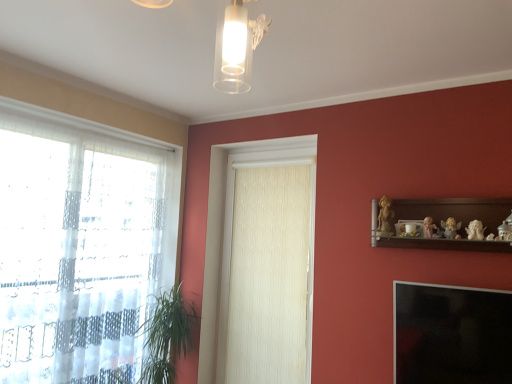
Where is `matte white figurine at upper right, arranged as the 2th toy when viewed from the left`? The image size is (512, 384). matte white figurine at upper right, arranged as the 2th toy when viewed from the left is located at coordinates (426, 228).

You are a GUI agent. You are given a task and a screenshot of the screen. Output one action in this format:
    pyautogui.click(x=<x>, y=<y>)
    Task: Click on the transparent fabric at left
    This screenshot has width=512, height=384.
    Given the screenshot: What is the action you would take?
    pyautogui.click(x=78, y=247)

Describe the element at coordinates (78, 247) in the screenshot. I see `transparent fabric at left` at that location.

Image resolution: width=512 pixels, height=384 pixels. What are the coordinates of `white porcelain figurine at upper right, which ranks as the second toy in right-to-left order` in the screenshot? It's located at (475, 230).

What is the approximate height of porcelain figurine at upper right, arranged as the fifth toy when viewed from the left?

The height of porcelain figurine at upper right, arranged as the fifth toy when viewed from the left, is 6.94 inches.

The height and width of the screenshot is (384, 512). Find the location of `matte gold angel at upper right, which appears as the 3th toy when viewed from the left`. matte gold angel at upper right, which appears as the 3th toy when viewed from the left is located at coordinates [x=450, y=228].

Considering the relative positions of white textured curtain at center and wooden shelf at upper right in the image provided, is white textured curtain at center to the right of wooden shelf at upper right from the viewer's perspective?

Incorrect, white textured curtain at center is not on the right side of wooden shelf at upper right.

Is white textured curtain at center touching wooden shelf at upper right?

No.

Which is behind, white textured curtain at center or wooden shelf at upper right?

white textured curtain at center is behind.

Measure the distance between white textured curtain at center and wooden shelf at upper right.

1.09 meters.

Is white porcelain figurine at upper right, positioned as the fourth toy in left-to-right order, positioned with its back to porcelain figurine at upper right, which is the first toy in right-to-left order?

No, white porcelain figurine at upper right, positioned as the fourth toy in left-to-right order, is not facing away from porcelain figurine at upper right, which is the first toy in right-to-left order.

At what (x,y) coordinates should I click in order to perform the action: click on the 3rd toy below the porcelain figurine at upper right, which is the first toy in right-to-left order (from the image's perspective). Please return your answer as a coordinate pair (x, y). Looking at the image, I should click on pos(475,230).

Based on the photo, which object is further away from the camera, white porcelain figurine at upper right, positioned as the fourth toy in left-to-right order, or porcelain figurine at upper right, which is the first toy in right-to-left order?

white porcelain figurine at upper right, positioned as the fourth toy in left-to-right order, is further away from the camera.

From the picture: From the image's perspective, is white porcelain figurine at upper right, positioned as the fourth toy in left-to-right order, above or below porcelain figurine at upper right, arranged as the fifth toy when viewed from the left?

white porcelain figurine at upper right, positioned as the fourth toy in left-to-right order, is situated lower than porcelain figurine at upper right, arranged as the fifth toy when viewed from the left, in the image.

Which object is closer to the camera taking this photo, white textured curtain at center or porcelain figurine at upper right, which is the first toy in right-to-left order?

Positioned in front is porcelain figurine at upper right, which is the first toy in right-to-left order.

Does white textured curtain at center have a smaller size compared to porcelain figurine at upper right, arranged as the fifth toy when viewed from the left?

No, white textured curtain at center is not smaller than porcelain figurine at upper right, arranged as the fifth toy when viewed from the left.

Is white textured curtain at center to the left of porcelain figurine at upper right, arranged as the fifth toy when viewed from the left, from the viewer's perspective?

Yes.

Is white textured curtain at center in contact with porcelain figurine at upper right, which is the first toy in right-to-left order?

white textured curtain at center and porcelain figurine at upper right, which is the first toy in right-to-left order, are not in contact.

Is transparent fabric at left shorter than porcelain figurine at upper right, arranged as the fifth toy when viewed from the left?

No.

Can you confirm if transparent fabric at left is bigger than porcelain figurine at upper right, which is the first toy in right-to-left order?

Yes.

Choose the correct answer: Is transparent fabric at left inside porcelain figurine at upper right, which is the first toy in right-to-left order, or outside it?

transparent fabric at left cannot be found inside porcelain figurine at upper right, which is the first toy in right-to-left order.

Could you tell me if transparent fabric at left is facing porcelain figurine at upper right, which is the first toy in right-to-left order?

Yes, transparent fabric at left is turned towards porcelain figurine at upper right, which is the first toy in right-to-left order.

Who is more distant, transparent fabric at left or wooden shelf at upper right?

transparent fabric at left.

In the scene shown: How much distance is there between transparent fabric at left and wooden shelf at upper right?

transparent fabric at left and wooden shelf at upper right are 6.91 feet apart.

In terms of height, does transparent fabric at left look taller or shorter compared to wooden shelf at upper right?

transparent fabric at left is taller than wooden shelf at upper right.

At what (x,y) coordinates should I click in order to perform the action: click on shelf that appears in front of the transparent fabric at left. Please return your answer as a coordinate pair (x, y). Looking at the image, I should click on (446, 218).

Is matte white figurine at upper right, arranged as the 2th toy when viewed from the left, not near transparent glass window screen at lower right?

They are positioned close to each other.

Does point (426, 233) come closer to viewer compared to point (476, 299)?

That is False.

Considering the relative positions of matte white figurine at upper right, marked as the 4th toy in a right-to-left arrangement, and transparent glass window screen at lower right in the image provided, is matte white figurine at upper right, marked as the 4th toy in a right-to-left arrangement, to the left or to the right of transparent glass window screen at lower right?

matte white figurine at upper right, marked as the 4th toy in a right-to-left arrangement, is to the left of transparent glass window screen at lower right.

Are white textured curtain at center and white porcelain figurine at upper right, which ranks as the second toy in right-to-left order, beside each other?

white textured curtain at center is not next to white porcelain figurine at upper right, which ranks as the second toy in right-to-left order, and they're not touching.

Relative to white porcelain figurine at upper right, which ranks as the second toy in right-to-left order, is white textured curtain at center in front or behind?

Clearly, white textured curtain at center is behind white porcelain figurine at upper right, which ranks as the second toy in right-to-left order.

Measure the distance from white textured curtain at center to white porcelain figurine at upper right, positioned as the fourth toy in left-to-right order.

The distance of white textured curtain at center from white porcelain figurine at upper right, positioned as the fourth toy in left-to-right order, is 1.56 meters.

From a real-world perspective, is white textured curtain at center physically below white porcelain figurine at upper right, which ranks as the second toy in right-to-left order?

Yes, from a real-world perspective, white textured curtain at center is below white porcelain figurine at upper right, which ranks as the second toy in right-to-left order.

In order to click on shelf above the white textured curtain at center (from a real-world perspective) in this screenshot , I will do coord(446,218).

From the image's perspective, starting from the white porcelain figurine at upper right, which ranks as the second toy in right-to-left order, which toy is the 3rd one above? Please provide its 2D coordinates.

[(505, 230)]

In the scene shown: When comparing their distances from green leafy plant at lower left, does porcelain figurine at upper right, which is the first toy in right-to-left order, or white textured curtain at center seem closer?

white textured curtain at center is closer to green leafy plant at lower left.

Estimate the real-world distances between objects in this image. Which object is closer to green leafy plant at lower left, matte white figurine at upper right, marked as the 4th toy in a right-to-left arrangement, or wooden statue at upper right, the 5th toy when ordered from right to left?

wooden statue at upper right, the 5th toy when ordered from right to left, lies closer to green leafy plant at lower left than the other object.

Considering their positions, is matte white figurine at upper right, marked as the 4th toy in a right-to-left arrangement, positioned further to wooden shelf at upper right than porcelain figurine at upper right, which is the first toy in right-to-left order?

The object further to wooden shelf at upper right is porcelain figurine at upper right, which is the first toy in right-to-left order.

Consider the image. Considering their positions, is porcelain figurine at upper right, arranged as the fifth toy when viewed from the left, positioned closer to white textured curtain at center than white porcelain figurine at upper right, positioned as the fourth toy in left-to-right order?

white porcelain figurine at upper right, positioned as the fourth toy in left-to-right order, is positioned closer to the anchor white textured curtain at center.

Considering their positions, is matte white figurine at upper right, arranged as the 2th toy when viewed from the left, positioned closer to white textured curtain at center than matte gold angel at upper right, the 3th toy when ordered from right to left?

A: Among the two, matte white figurine at upper right, arranged as the 2th toy when viewed from the left, is located nearer to white textured curtain at center.

Considering their positions, is white textured curtain at center positioned further to matte white figurine at upper right, arranged as the 2th toy when viewed from the left, than transparent fabric at left?

transparent fabric at left is further to matte white figurine at upper right, arranged as the 2th toy when viewed from the left.

Looking at the image, which one is located closer to porcelain figurine at upper right, which is the first toy in right-to-left order, white textured curtain at center or transparent fabric at left?

The object closer to porcelain figurine at upper right, which is the first toy in right-to-left order, is white textured curtain at center.

In the scene shown: From the image, which object appears to be farther from wooden statue at upper right, the 5th toy when ordered from right to left, green leafy plant at lower left or matte gold angel at upper right, the 3th toy when ordered from right to left?

Based on the image, green leafy plant at lower left appears to be further to wooden statue at upper right, the 5th toy when ordered from right to left.

The image size is (512, 384). Identify the location of toy situated between wooden statue at upper right, the 5th toy when ordered from right to left, and matte gold angel at upper right, the 3th toy when ordered from right to left, from left to right. (426, 228).

Identify the location of toy located between transparent fabric at left and matte white figurine at upper right, arranged as the 2th toy when viewed from the left, in the left-right direction. The height and width of the screenshot is (384, 512). (385, 217).

This screenshot has height=384, width=512. I want to click on shelf located between transparent fabric at left and matte gold angel at upper right, which appears as the 3th toy when viewed from the left, in the left-right direction, so click(x=446, y=218).

I want to click on curtain between green leafy plant at lower left and white porcelain figurine at upper right, which ranks as the second toy in right-to-left order, in the horizontal direction, so click(x=269, y=276).